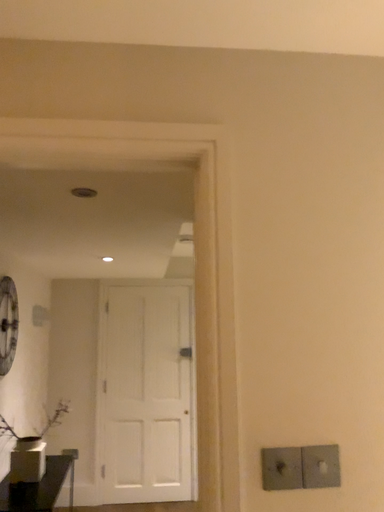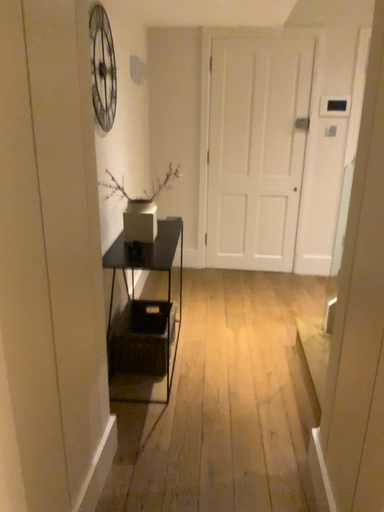
Question: How did the camera likely rotate when shooting the video?

Choices:
 (A) rotated downward
 (B) rotated upward

Answer: (A)